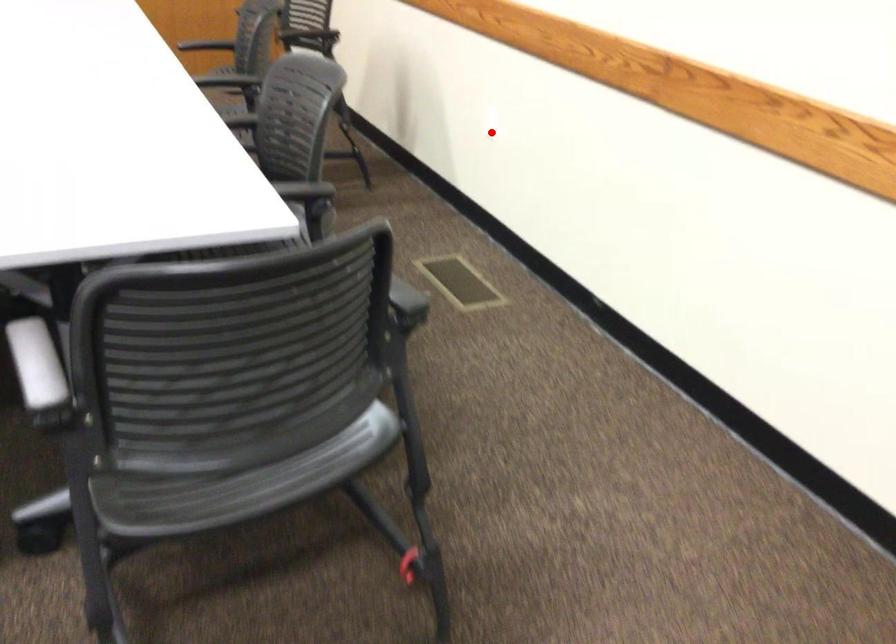
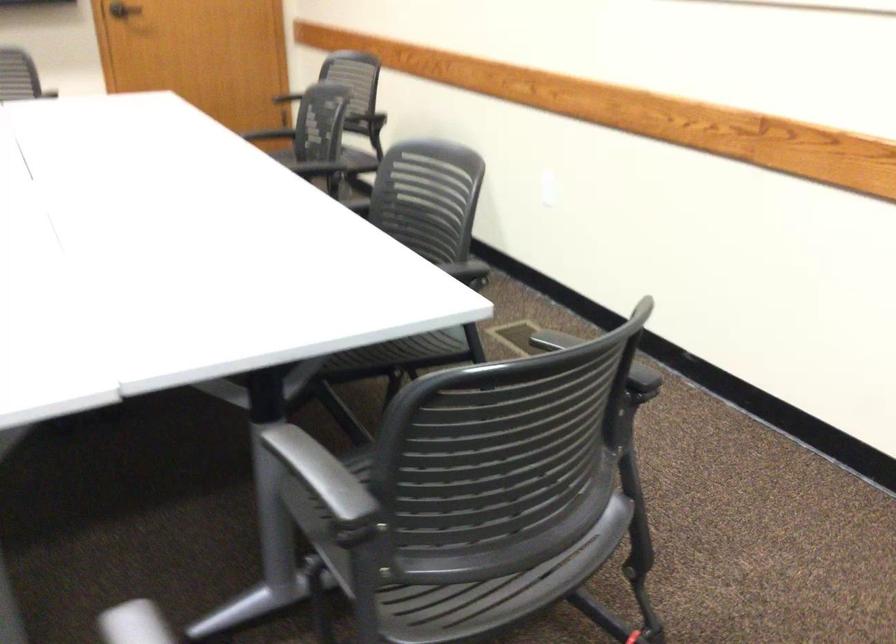
Find the pixel in the second image that matches the highlighted location in the first image.

(547, 196)